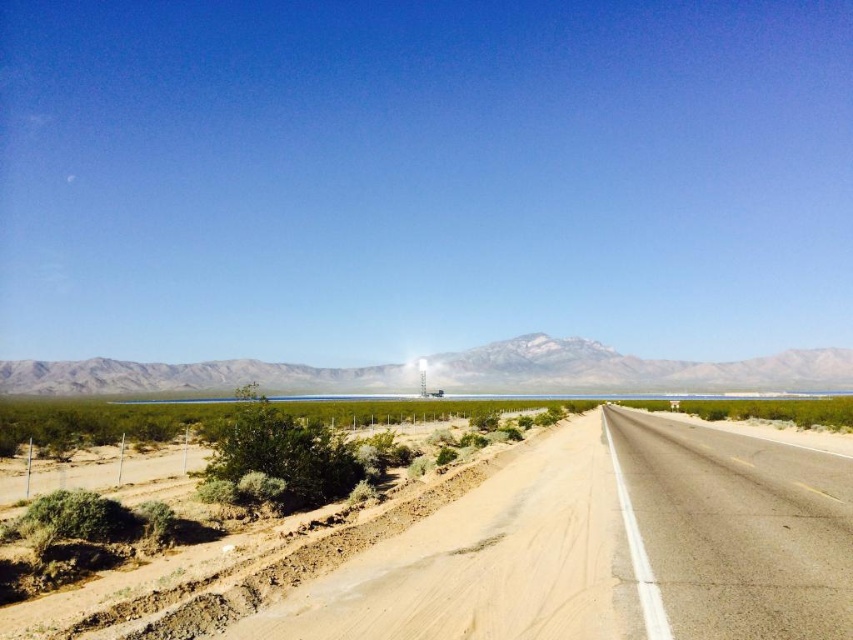
How much distance is there between asphalt road at right and green shrubbery at lower left?

They are 9.19 meters apart.

Who is taller, asphalt road at right or green shrubbery at lower left?

Standing taller between the two is asphalt road at right.

Does point (801, 465) come behind point (314, 566)?

Yes, it is behind point (314, 566).

You are a GUI agent. You are given a task and a screenshot of the screen. Output one action in this format:
    pyautogui.click(x=<x>, y=<y>)
    Task: Click on the asphalt road at right
    The image size is (853, 640).
    Given the screenshot: What is the action you would take?
    pyautogui.click(x=740, y=529)

Does gray rocky mountain at center lie in front of green shrubbery at lower left?

No.

Does gray rocky mountain at center appear under green shrubbery at lower left?

Correct, gray rocky mountain at center is located below green shrubbery at lower left.

Where is `gray rocky mountain at center`? The image size is (853, 640). gray rocky mountain at center is located at coordinates (630, 369).

Where is `gray rocky mountain at center`? The width and height of the screenshot is (853, 640). gray rocky mountain at center is located at coordinates (630, 369).

At what (x,y) coordinates should I click in order to perform the action: click on asphalt road at center. Please return your answer as a coordinate pair (x, y). Looking at the image, I should click on (606, 547).

The height and width of the screenshot is (640, 853). I want to click on asphalt road at center, so click(606, 547).